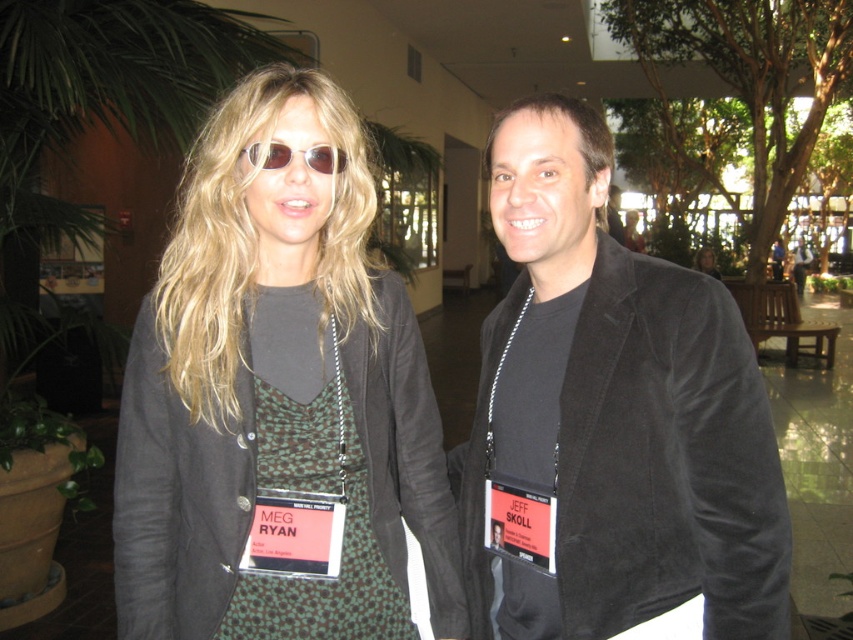
You are organizing a photoshoot and need to arrange two jackets for a catalog. The matte black jacket at center and the suede jacket at center are currently in the scene. Which jacket should be moved to the right to align with the catalog layout that requires the suede jacket to be on the right side?

The matte black jacket at center is positioned on the left side of the suede jacket at center. To align with the catalog layout requiring the suede jacket to be on the right, you should move the matte black jacket at center to the right so that the suede jacket at center ends up on the right side.

You are a photographer adjusting the focus on your camera. You notice two points in the image at coordinates point (573,225) and point (282,160). Which point should you focus on first if you want to ensure the foreground is sharp?

You should focus on point (282,160) first because it is closer to the camera than point (573,225), ensuring the foreground elements are in sharp focus.